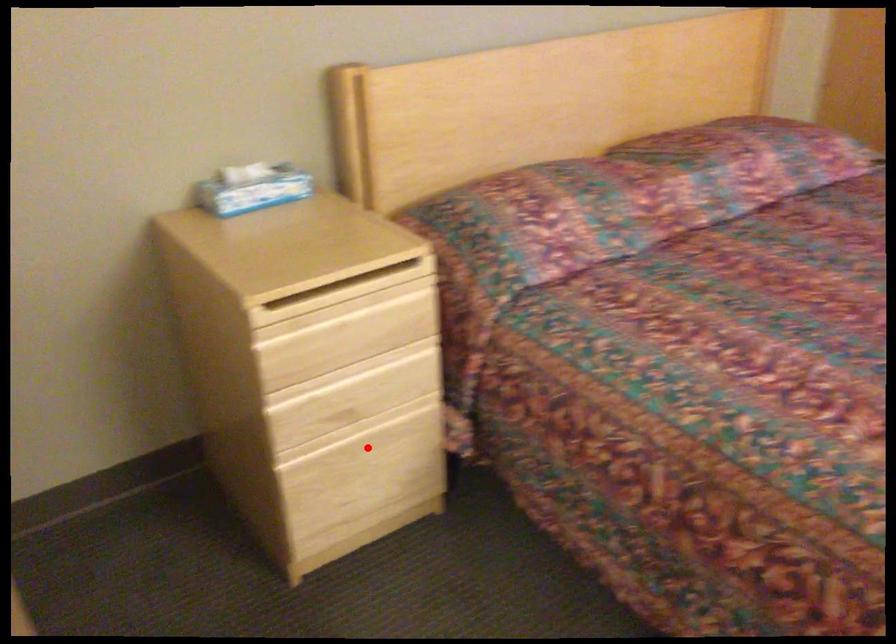
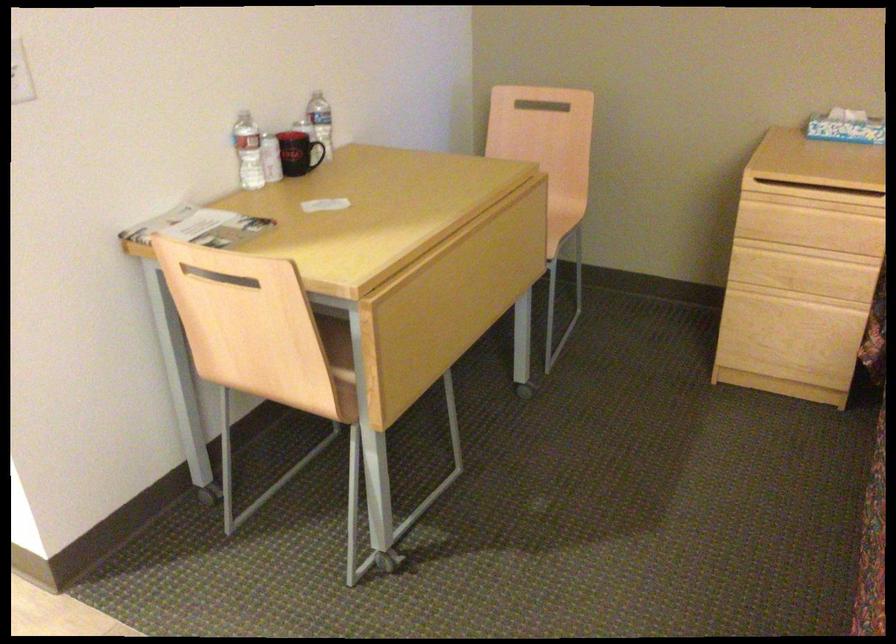
The point at the highlighted location is marked in the first image. Where is the corresponding point in the second image?

(790, 313)